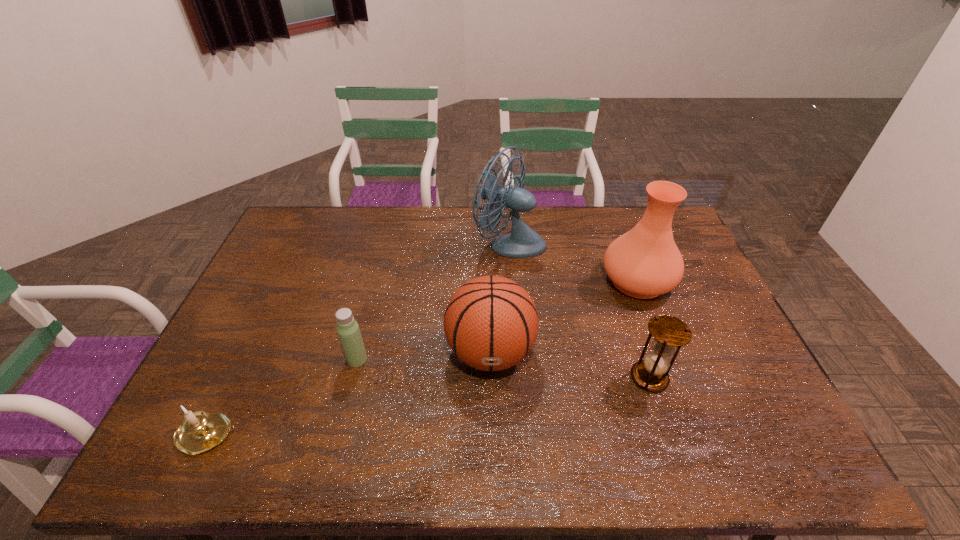
The image size is (960, 540). I want to click on blank region between the vase and the third tallest object, so click(564, 316).

Image resolution: width=960 pixels, height=540 pixels. Find the location of `blank region between the vase and the hourglass`. blank region between the vase and the hourglass is located at coordinates (643, 329).

The width and height of the screenshot is (960, 540). In order to click on empty space that is in between the leftmost object and the hourglass in this screenshot , I will do `click(429, 406)`.

What are the coordinates of `object that is the closest one to the fan` in the screenshot? It's located at (643, 263).

The height and width of the screenshot is (540, 960). In order to click on the fourth closest object to the fan in this screenshot , I will do `click(348, 330)`.

Where is `free space that satisfies the following two spatial constraints: 1. on the back side of the thermos bottle; 2. on the right side of the vase`? This screenshot has height=540, width=960. free space that satisfies the following two spatial constraints: 1. on the back side of the thermos bottle; 2. on the right side of the vase is located at coordinates (376, 281).

At what (x,y) coordinates should I click in order to perform the action: click on free space that satisfies the following two spatial constraints: 1. in front of the fan to blow air; 2. on the side where the inflation valve is located. Please return your answer as a coordinate pair (x, y). The image size is (960, 540). Looking at the image, I should click on (518, 352).

Where is `free space in the image that satisfies the following two spatial constraints: 1. in front of the fan to blow air; 2. on the back side of the vase`? The width and height of the screenshot is (960, 540). free space in the image that satisfies the following two spatial constraints: 1. in front of the fan to blow air; 2. on the back side of the vase is located at coordinates (513, 281).

This screenshot has height=540, width=960. Find the location of `free space that satisfies the following two spatial constraints: 1. in front of the fan to blow air; 2. on the right side of the vase`. free space that satisfies the following two spatial constraints: 1. in front of the fan to blow air; 2. on the right side of the vase is located at coordinates (513, 281).

You are a GUI agent. You are given a task and a screenshot of the screen. Output one action in this format:
    pyautogui.click(x=<x>, y=<y>)
    Task: Click on the vacant region that satisfies the following two spatial constraints: 1. on the front side of the vase; 2. on the handle side of the leftmost object
    This screenshot has height=540, width=960.
    Given the screenshot: What is the action you would take?
    pyautogui.click(x=696, y=435)